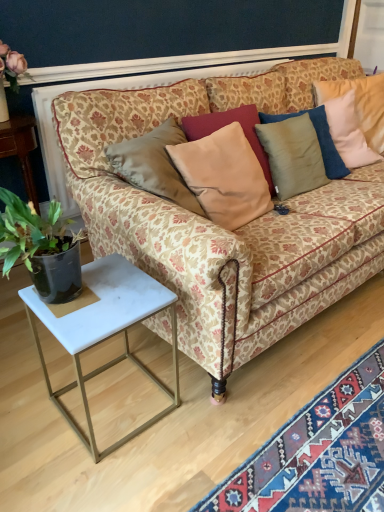
You are a GUI agent. You are given a task and a screenshot of the screen. Output one action in this format:
    pyautogui.click(x=<x>, y=<y>)
    Task: Click on the vacant space to the right of white marble side table at lower left
    This screenshot has width=384, height=512.
    Given the screenshot: What is the action you would take?
    pyautogui.click(x=207, y=412)